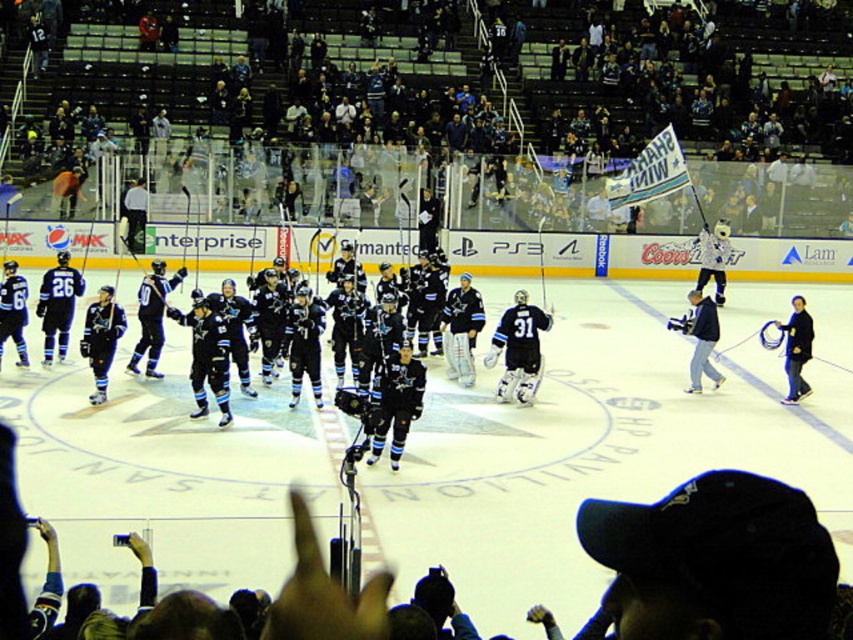
Question: Is dark blue jersey at upper center above black jersey at center?

Choices:
 (A) yes
 (B) no

Answer: (A)

Question: Observing the image, what is the correct spatial positioning of dark blue jersey at upper center in reference to black jersey at center?

Choices:
 (A) above
 (B) below

Answer: (A)

Question: Is dark blue jersey at upper center below black jersey at center?

Choices:
 (A) no
 (B) yes

Answer: (A)

Question: Which point is closer to the camera?

Choices:
 (A) dark blue jersey at upper center
 (B) black jersey at center

Answer: (B)